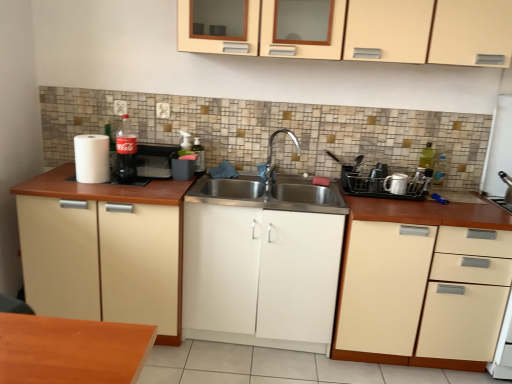
The height and width of the screenshot is (384, 512). Identify the location of vacant space in front of white glossy mug at right, the first appliance from the right. (413, 207).